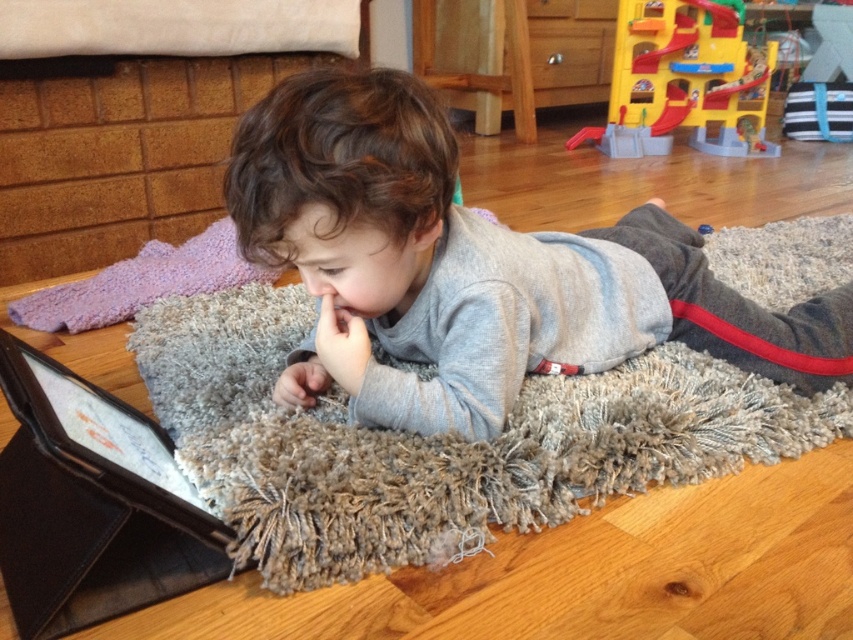
Does gray soft fabric at center have a greater width compared to yellow plastic playset at upper right?

Yes.

Does point (296, 97) come farther from viewer compared to point (764, 93)?

No, it is in front of (764, 93).

Consider the image. Who is more forward, (233, 211) or (612, 106)?

Positioned in front is point (233, 211).

The height and width of the screenshot is (640, 853). What are the coordinates of `gray soft fabric at center` in the screenshot? It's located at (473, 268).